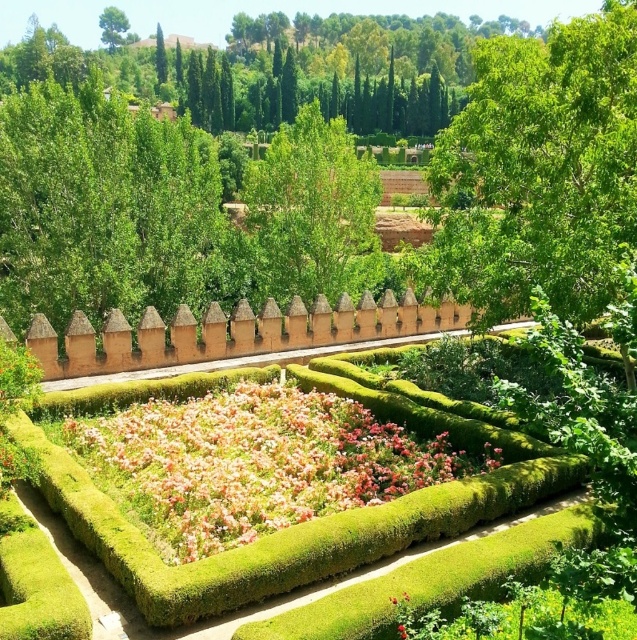
Question: Does green leafy tree at upper right appear on the right side of green leafy tree at upper center?

Choices:
 (A) yes
 (B) no

Answer: (A)

Question: Is green leafy tree at upper right to the left of green mossy hedge at center from the viewer's perspective?

Choices:
 (A) no
 (B) yes

Answer: (A)

Question: Which point appears closest to the camera in this image?

Choices:
 (A) (117, 28)
 (B) (578, 456)
 (C) (138, 440)

Answer: (B)

Question: Considering the real-world distances, which object is closest to the pink soft-textured flowers at center?

Choices:
 (A) green leafy tree at upper right
 (B) green leafy tree at upper center

Answer: (A)

Question: Does pink soft-textured flowers at center have a greater width compared to green mossy hedge at center?

Choices:
 (A) no
 (B) yes

Answer: (A)

Question: Estimate the real-world distances between objects in this image. Which object is closer to the pink soft-textured flowers at center?

Choices:
 (A) green mossy hedge at center
 (B) green leafy tree at center
 (C) green leafy tree at upper right
 (D) green leafy tree at upper center

Answer: (A)